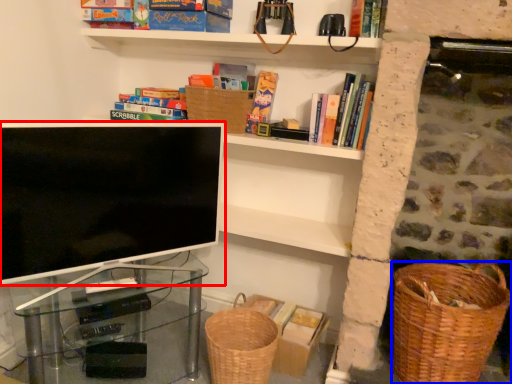
Question: Which point is closer to the camera, television (highlighted by a red box) or basket container (highlighted by a blue box)?

Choices:
 (A) television
 (B) basket container

Answer: (A)